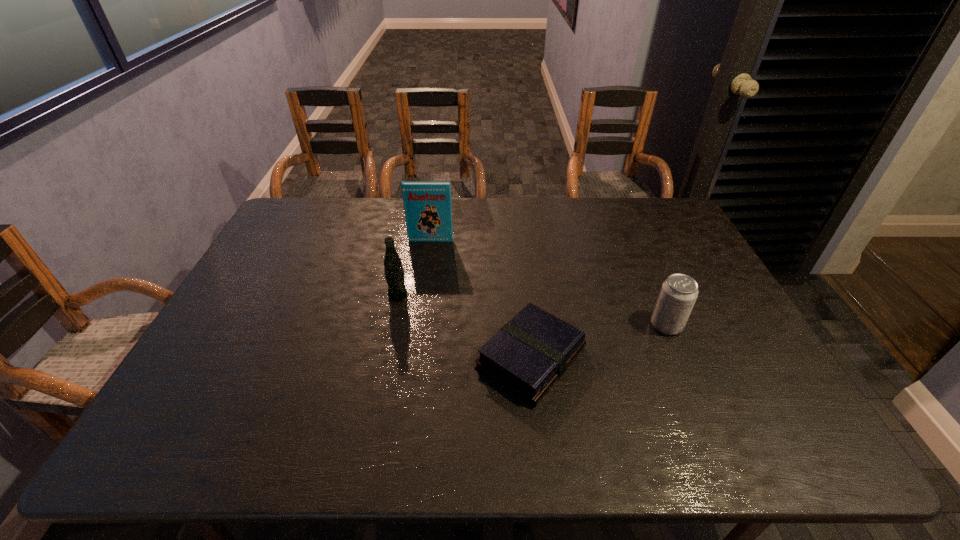
Find the location of `object identified as the closest to the rightmost object`. object identified as the closest to the rightmost object is located at coordinates (527, 356).

In order to click on object that can be found as the third closest to the farther book in this screenshot , I will do `click(678, 294)`.

What are the coordinates of `free spot that satisfies the following two spatial constraints: 1. on the front cover of the farther book; 2. on the left side of the shorter book` in the screenshot? It's located at (414, 358).

Find the location of a particular element. vacant point that satisfies the following two spatial constraints: 1. on the front cover of the soda can; 2. on the left side of the farthest object is located at coordinates (419, 325).

Locate an element on the screen. vacant position in the image that satisfies the following two spatial constraints: 1. on the front cover of the farther book; 2. on the right side of the rightmost object is located at coordinates (419, 325).

Identify the location of free location that satisfies the following two spatial constraints: 1. on the front cover of the soda can; 2. on the left side of the taller book. (419, 325).

The width and height of the screenshot is (960, 540). Identify the location of free spot that satisfies the following two spatial constraints: 1. on the front cover of the farthest object; 2. on the right side of the rightmost object. (419, 325).

Find the location of `free space that satisfies the following two spatial constraints: 1. on the front cover of the farthest object; 2. on the left side of the rightmost object`. free space that satisfies the following two spatial constraints: 1. on the front cover of the farthest object; 2. on the left side of the rightmost object is located at coordinates (419, 325).

The height and width of the screenshot is (540, 960). What are the coordinates of `vacant space that satisfies the following two spatial constraints: 1. on the front cover of the shorter book; 2. on the right side of the left book` in the screenshot? It's located at (414, 358).